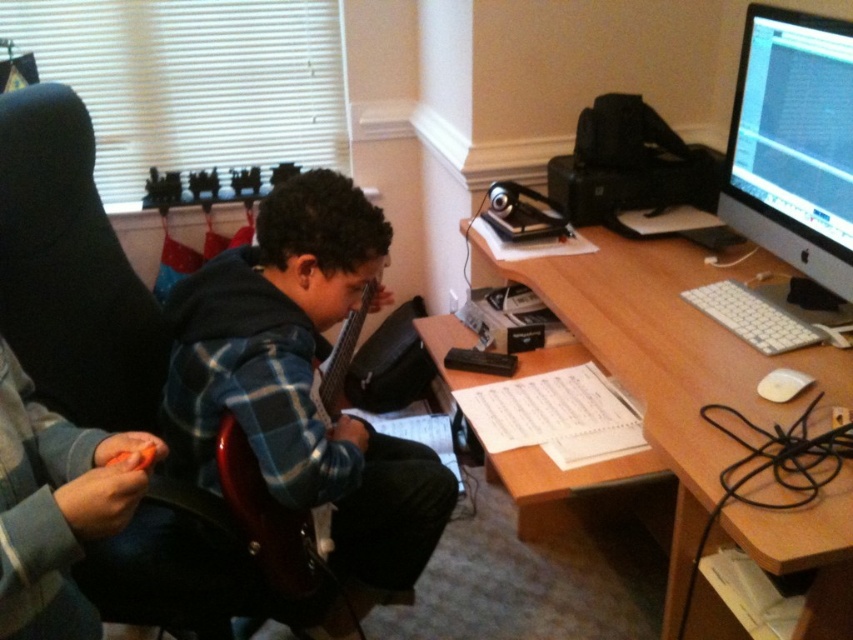
Question: Does wooden acoustic guitar at center have a larger size compared to wooden at upper right?

Choices:
 (A) yes
 (B) no

Answer: (B)

Question: Which object is closer to the camera taking this photo?

Choices:
 (A) wooden at upper right
 (B) orange plastic toy at lower left
 (C) black glossy monitor at upper right

Answer: (B)

Question: Among these points, which one is nearest to the camera?

Choices:
 (A) (735, 120)
 (B) (193, 419)
 (C) (28, 394)

Answer: (C)

Question: Which point is farther to the camera?

Choices:
 (A) wooden acoustic guitar at center
 (B) orange plastic toy at lower left
 (C) black glossy monitor at upper right
 (D) wooden at upper right

Answer: (C)

Question: Is wooden at upper right to the right of orange plastic toy at lower left from the viewer's perspective?

Choices:
 (A) yes
 (B) no

Answer: (A)

Question: Can you confirm if black glossy monitor at upper right is bigger than orange plastic toy at lower left?

Choices:
 (A) yes
 (B) no

Answer: (A)